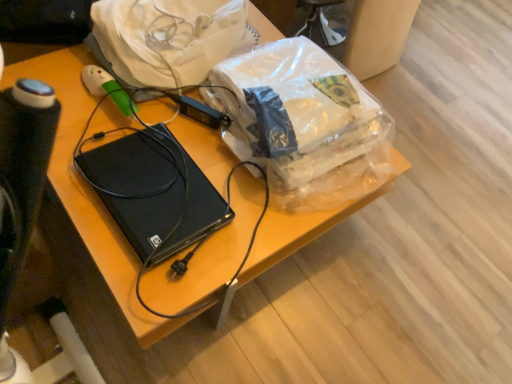
Locate an element on the screen. Image resolution: width=512 pixels, height=384 pixels. vacant space in between black plastic computer at center and translucent plastic bag at center is located at coordinates (214, 181).